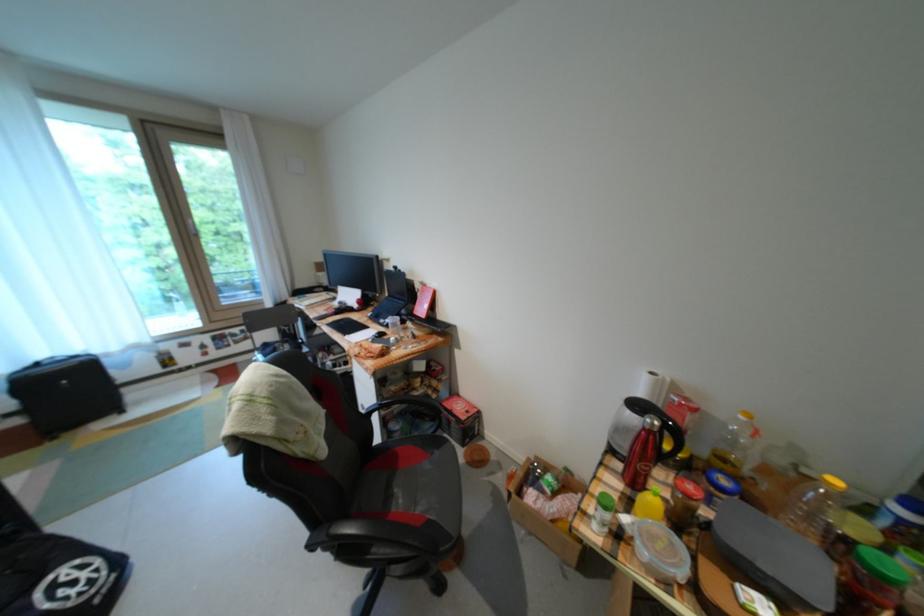
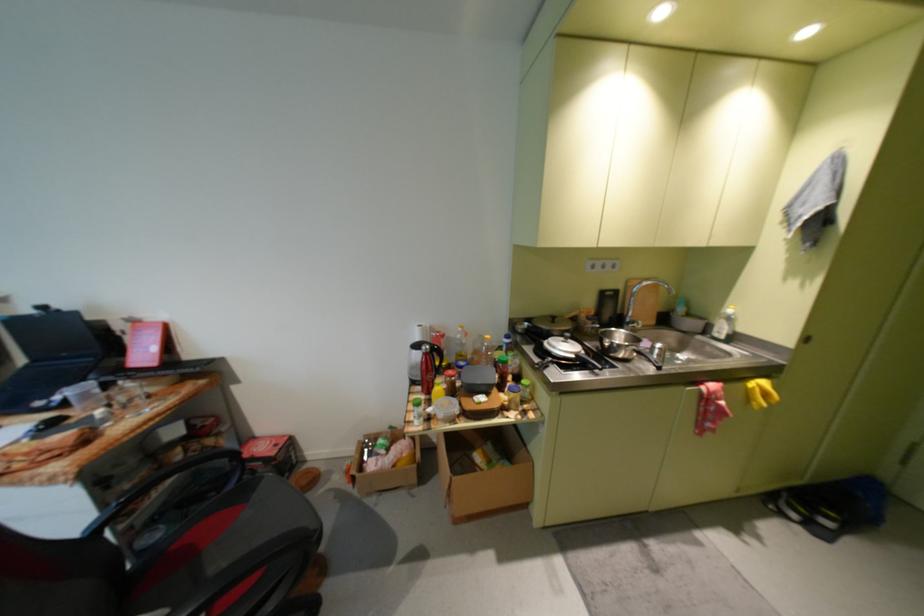
In the second image, find the point that corresponds to pixel 634 495 in the first image.

(435, 400)